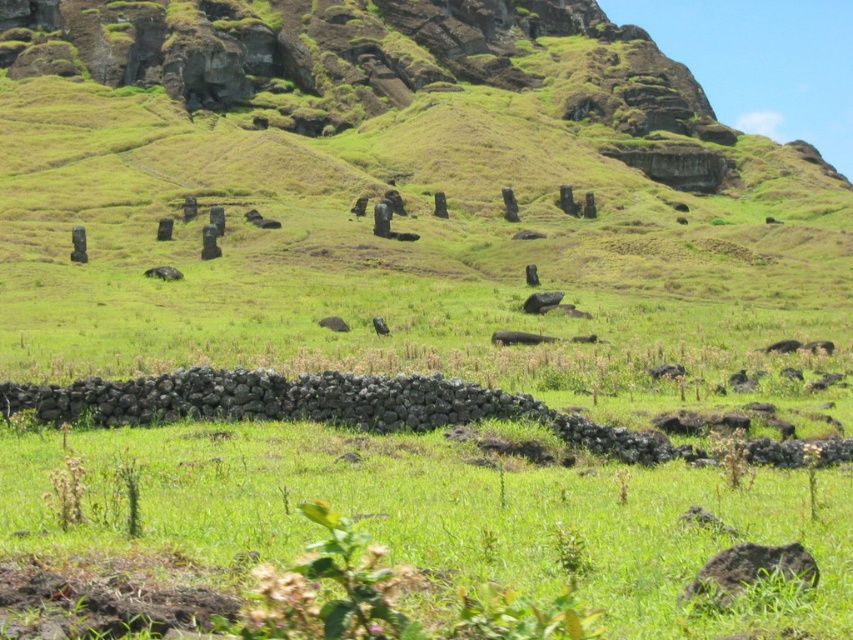
Question: Which object is positioned farthest from the black fur animal at center?

Choices:
 (A) green fuzzy bird at center
 (B) black stone moai at center

Answer: (B)

Question: Which point is closer to the camera taking this photo?

Choices:
 (A) (540, 296)
 (B) (492, 336)

Answer: (B)

Question: Does black fur animal at center have a larger size compared to brown stone moai at center?

Choices:
 (A) no
 (B) yes

Answer: (B)

Question: Considering the real-world distances, which object is closest to the green fuzzy bird at center?

Choices:
 (A) black fur animal at center
 (B) black stone moai at center
 (C) brown stone moai at center

Answer: (A)

Question: Does brown stone moai at center appear over green fuzzy bird at center?

Choices:
 (A) yes
 (B) no

Answer: (A)

Question: Is black stone moai at center above black matte animal at center?

Choices:
 (A) no
 (B) yes

Answer: (B)